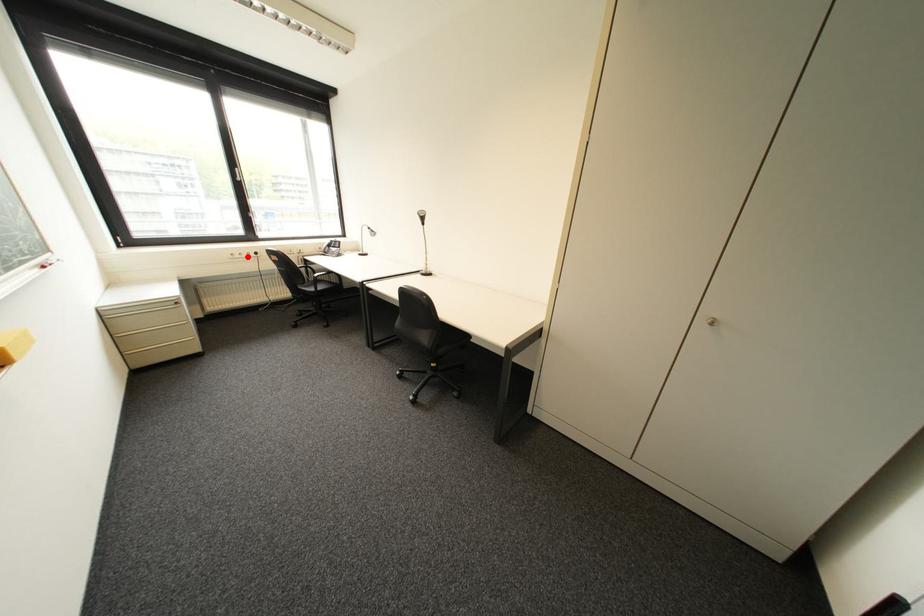
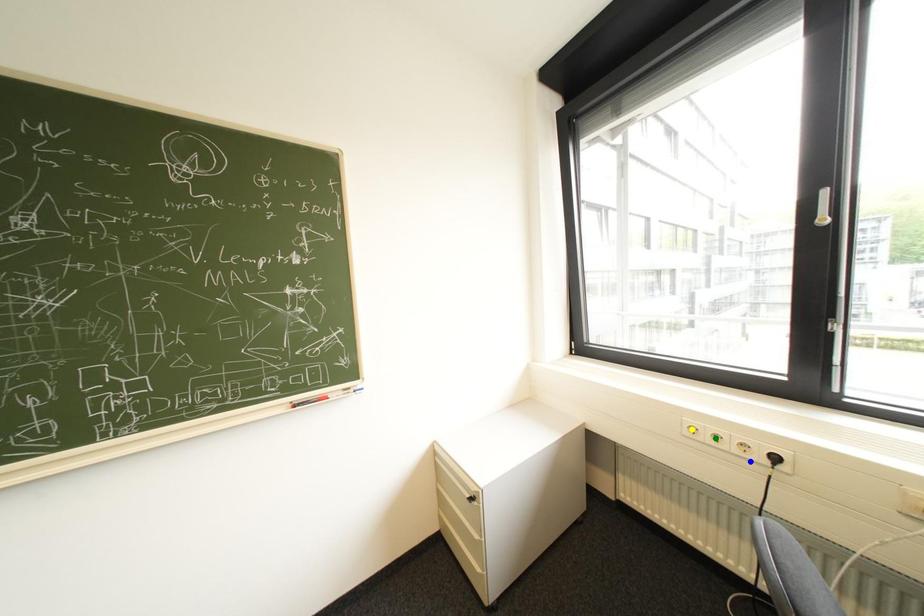
Question: I am providing you with two images of the same scene from different viewpoints. A red point is marked on the first image. You are given multiple points on the second image. Which point in image 2 is actually the same real-world point as the red point in image 1?

Choices:
 (A) yellow point
 (B) green point
 (C) blue point

Answer: (B)